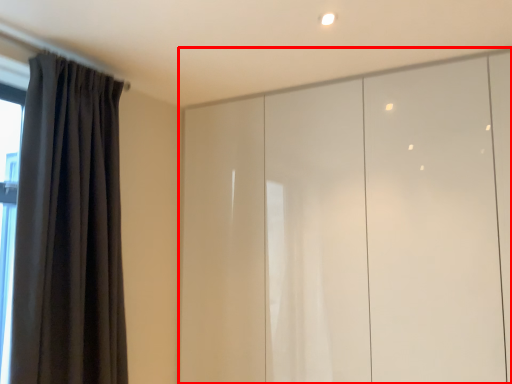
Question: From the image's perspective, where is cupboard (annotated by the red box) located relative to curtain?

Choices:
 (A) above
 (B) below

Answer: (B)